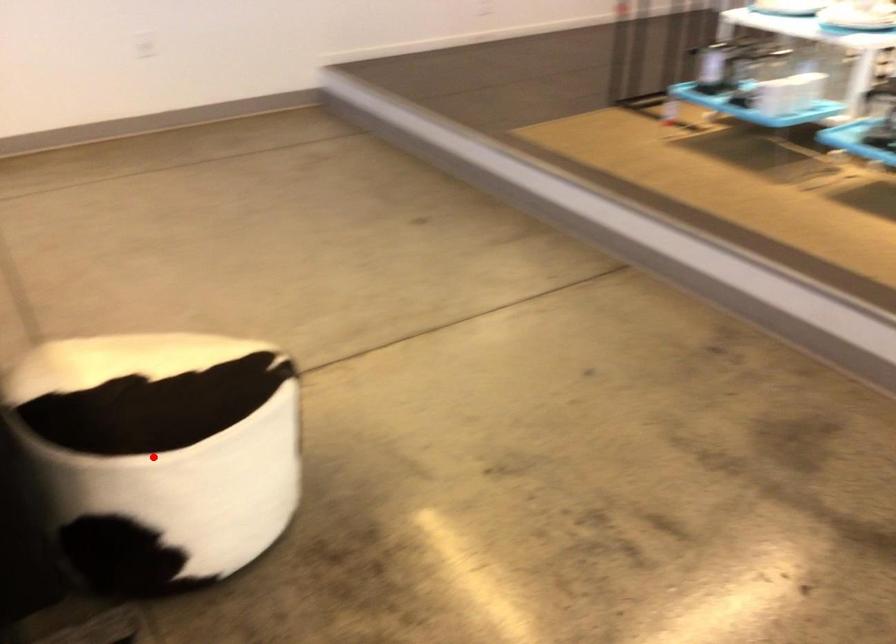
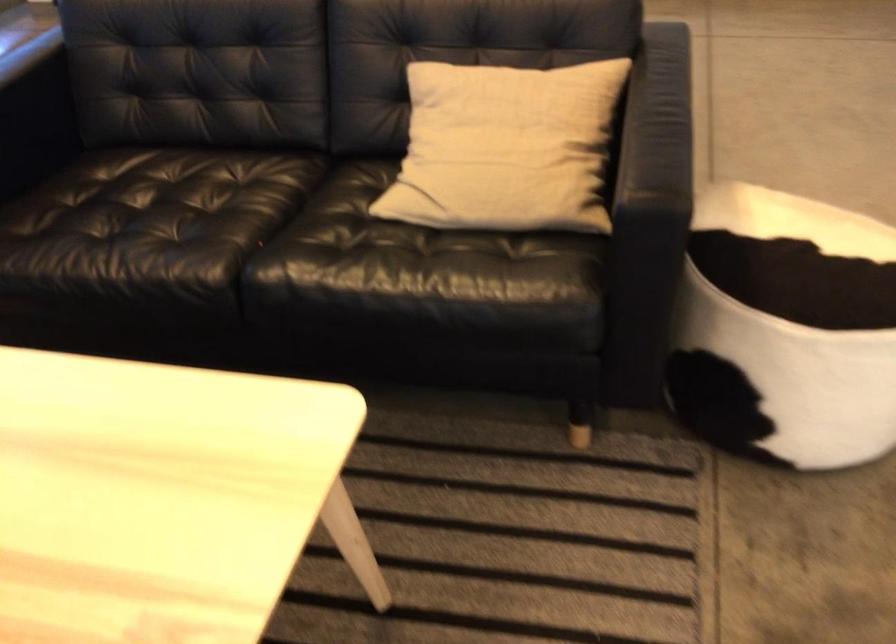
Find the pixel in the second image that matches the highlighted location in the first image.

(786, 330)